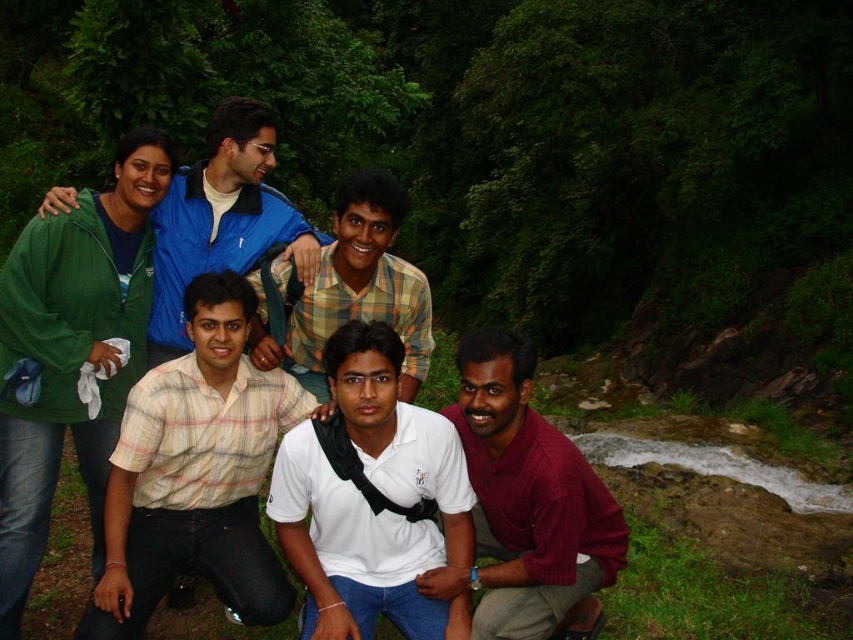
You are a photographer trying to capture a group photo of the six people in the forest. You notice the green fleece jacket at upper left and the checkered fabric shirt at center. Which clothing item is located more to the left in the image?

The green fleece jacket at upper left is positioned on the left side of the checkered fabric shirt at center, so it is more to the left.

You are a photographer trying to capture a closeup of the white matte shirt at center. Based on the coordinates provided, where should you aim your camera?

The white matte shirt at center is located at point (367,502), so aim your camera there to capture the closeup.